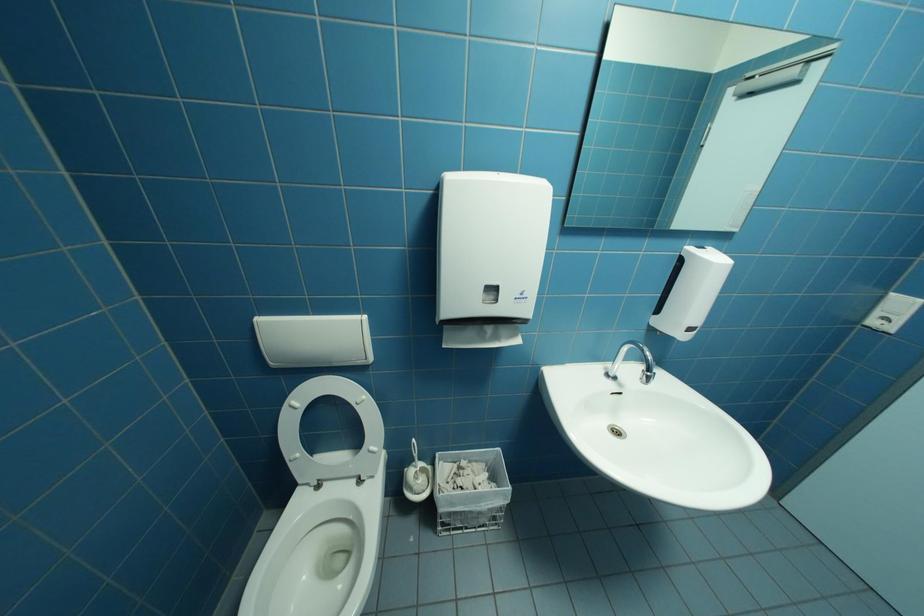
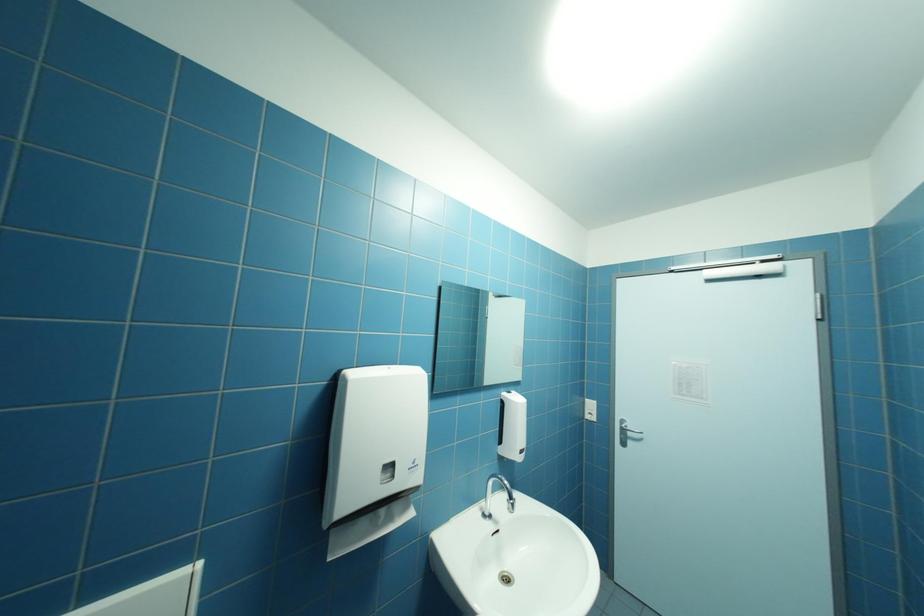
In the scene shown: First-person continuous shooting, in which direction is the camera rotating?

The camera's rotation is toward right-up.